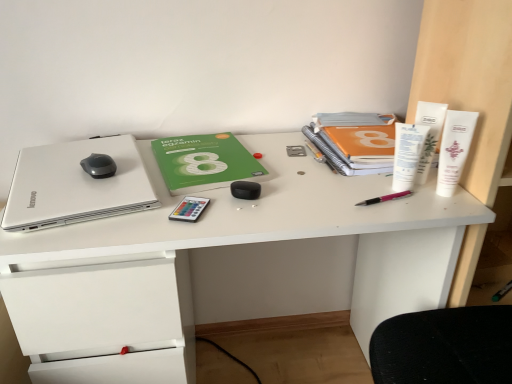
The height and width of the screenshot is (384, 512). I want to click on free space in front of white plastic tube at upper right, which ranks as the 4th stationery in left-to-right order, so click(x=426, y=206).